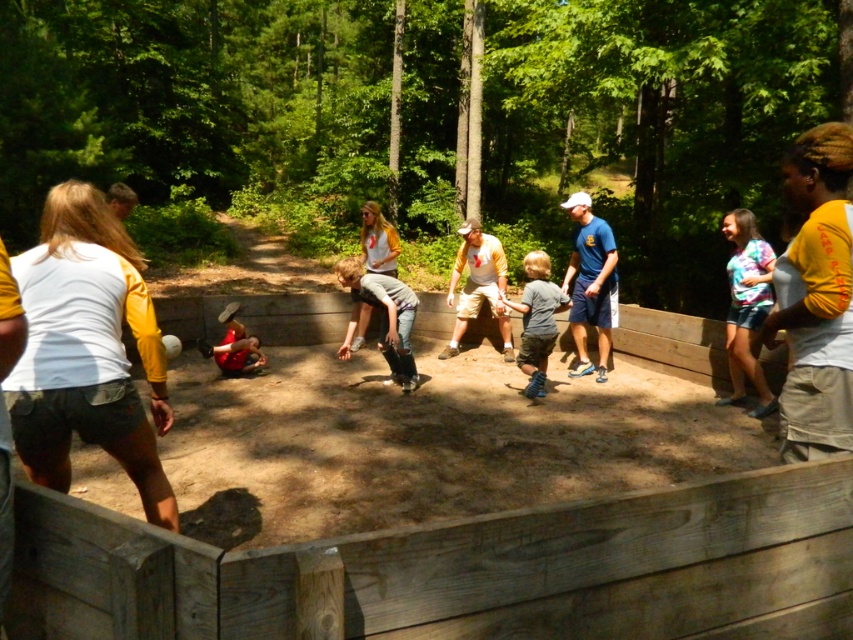
Describe the element at coordinates (590, 284) in the screenshot. I see `blue fabric shirt at center` at that location.

Is blue fabric shirt at center positioned at the back of gray denim jeans at center?

Yes, it is.

The height and width of the screenshot is (640, 853). Describe the element at coordinates (590, 284) in the screenshot. I see `blue fabric shirt at center` at that location.

Where is `blue fabric shirt at center`? blue fabric shirt at center is located at coordinates (590, 284).

Can you confirm if tie-dye shirt at right is smaller than blue fabric shirt at center?

Yes.

The width and height of the screenshot is (853, 640). Describe the element at coordinates (746, 307) in the screenshot. I see `tie-dye shirt at right` at that location.

Locate an element on the screen. tie-dye shirt at right is located at coordinates pyautogui.click(x=746, y=307).

Image resolution: width=853 pixels, height=640 pixels. Describe the element at coordinates (479, 285) in the screenshot. I see `yellow/white jersey at center` at that location.

Who is more forward, (473, 317) or (543, 307)?

Positioned in front is point (543, 307).

Is point (451, 337) more distant than point (549, 273)?

Yes.

The height and width of the screenshot is (640, 853). In order to click on yellow/white jersey at center in this screenshot , I will do `click(479, 285)`.